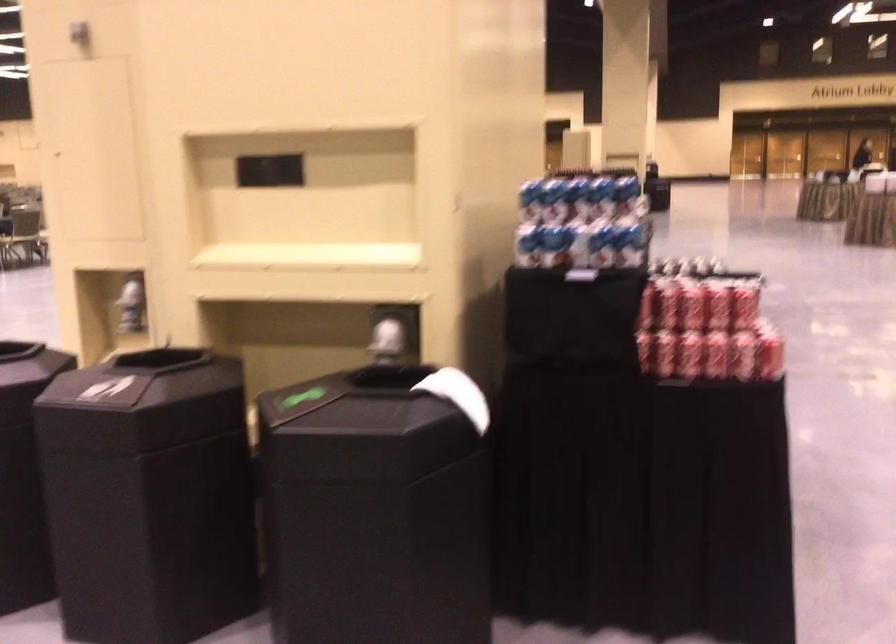
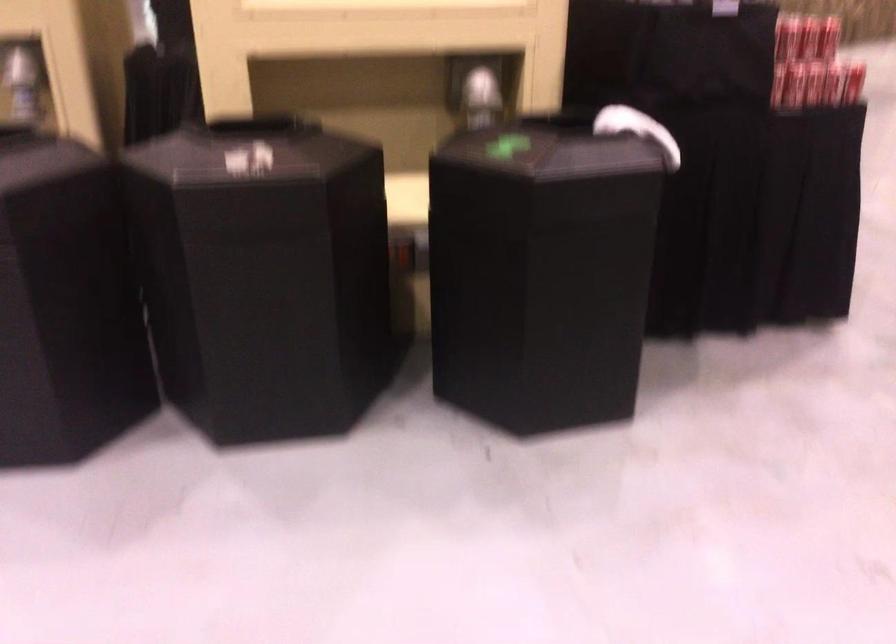
Find the pixel in the second image that matches pixel 661 359 in the first image.

(788, 84)